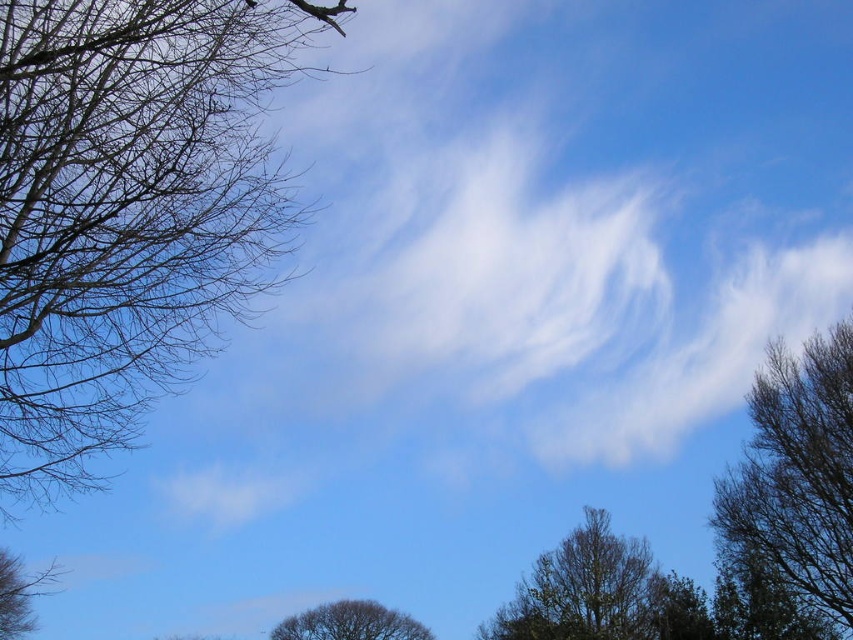
You are standing in a field looking at the sky. You see a brown textured tree at right and a brown textured tree at lower center. Which tree is positioned more to the east if the sun is setting in the west?

The brown textured tree at right is positioned more to the east because it is to the right of the brown textured tree at lower center, and since the sun is setting in the west, the right side of the image corresponds to the east direction.